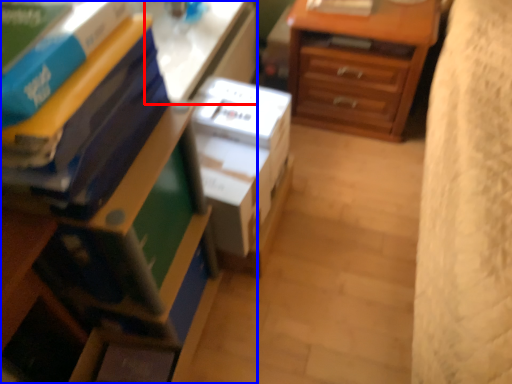
Question: Which object appears farthest to the camera in this image, table (highlighted by a red box) or nightstand (highlighted by a blue box)?

Choices:
 (A) table
 (B) nightstand

Answer: (A)